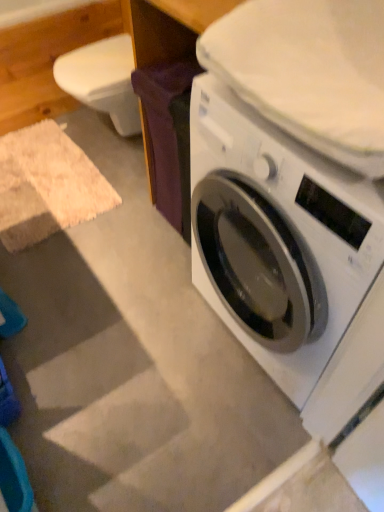
Question: Does point (162, 62) appear closer or farther from the camera than point (360, 181)?

Choices:
 (A) closer
 (B) farther

Answer: (B)

Question: From the image's perspective, relative to white glossy washing machine at lower right, is purple fabric at center above or below?

Choices:
 (A) below
 (B) above

Answer: (B)

Question: Is purple fabric at center wider or thinner than white glossy washing machine at lower right?

Choices:
 (A) wide
 (B) thin

Answer: (B)

Question: Considering the positions of white glossy washing machine at lower right and purple fabric at center in the image, is white glossy washing machine at lower right bigger or smaller than purple fabric at center?

Choices:
 (A) big
 (B) small

Answer: (A)

Question: In the image, is white glossy washing machine at lower right positioned in front of or behind purple fabric at center?

Choices:
 (A) behind
 (B) front

Answer: (B)

Question: Is white glossy washing machine at lower right situated inside purple fabric at center or outside?

Choices:
 (A) outside
 (B) inside

Answer: (A)

Question: Considering the positions of point (362, 247) and point (140, 57), is point (362, 247) closer or farther from the camera than point (140, 57)?

Choices:
 (A) farther
 (B) closer

Answer: (B)